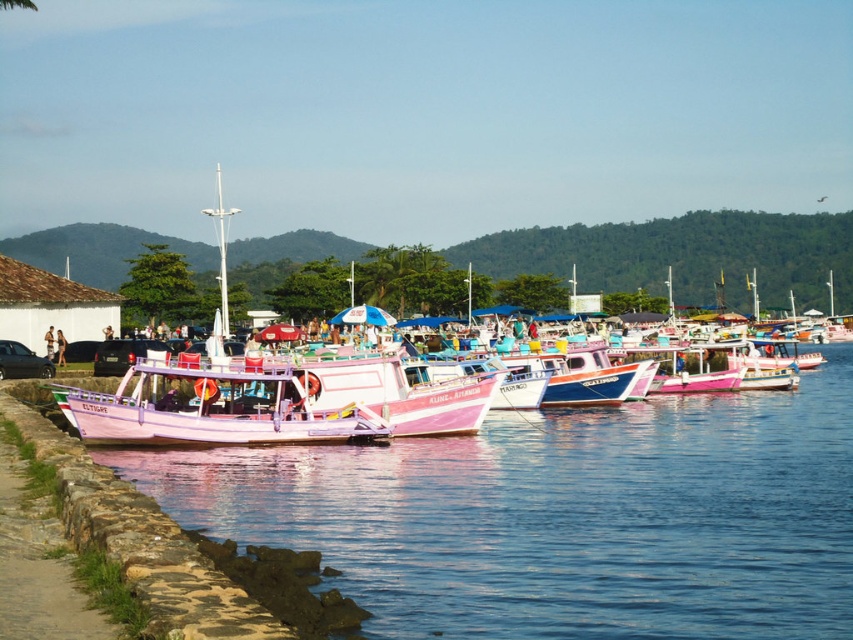
Looking at this image, who is taller, pink matte boat at center or pink fabric person at center?

With more height is pink matte boat at center.

Locate an element on the screen. The image size is (853, 640). pink matte boat at center is located at coordinates (173, 412).

Who is positioned more to the right, pastel matte boat at center or pink matte boat at center?

pink matte boat at center is more to the right.

Is point (314, 435) positioned behind point (709, 278)?

That is False.

At what (x,y) coordinates should I click in order to perform the action: click on pastel matte boat at center. Please return your answer as a coordinate pair (x, y). This screenshot has width=853, height=640. Looking at the image, I should click on (212, 408).

Can you confirm if pastel matte boat at center is positioned to the right of pink fabric person at center?

Yes, pastel matte boat at center is to the right of pink fabric person at center.

Which is behind, point (83, 426) or point (51, 332)?

The point (51, 332) is behind.

The image size is (853, 640). I want to click on pastel matte boat at center, so tap(212, 408).